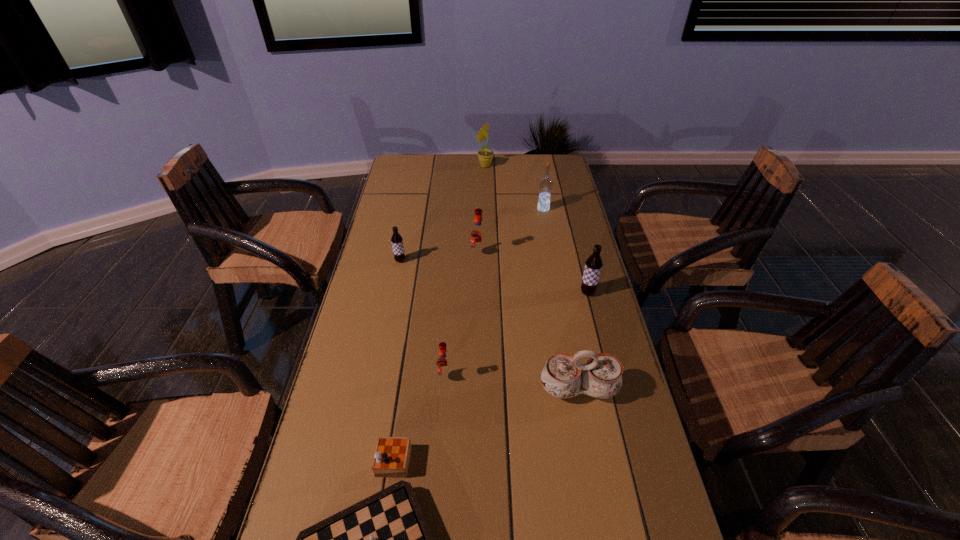
At what (x,y) coordinates should I click in order to perform the action: click on yellow sunflower. Please return your answer as a coordinate pair (x, y). Looking at the image, I should click on (485, 156).

I want to click on the farthest object, so click(485, 156).

At what (x,y) coordinates should I click in order to perform the action: click on the seventh nearest object. Please return your answer as a coordinate pair (x, y). Image resolution: width=960 pixels, height=540 pixels. Looking at the image, I should click on (546, 183).

This screenshot has height=540, width=960. What are the coordinates of `blue vodka` in the screenshot? It's located at (546, 183).

Identify the location of the farther red root beer. The image size is (960, 540). (478, 233).

Identify the location of the right red root beer. (478, 233).

At what (x,y) coordinates should I click in order to perform the action: click on the bigger brown root beer. Please return your answer as a coordinate pair (x, y). Looking at the image, I should click on (593, 265).

Where is `the nearer brown root beer`? This screenshot has width=960, height=540. the nearer brown root beer is located at coordinates (593, 265).

Locate an element on the screen. This screenshot has width=960, height=540. white chinaware is located at coordinates pos(563,375).

The image size is (960, 540). Identify the location of the smaller brown root beer. (397, 241).